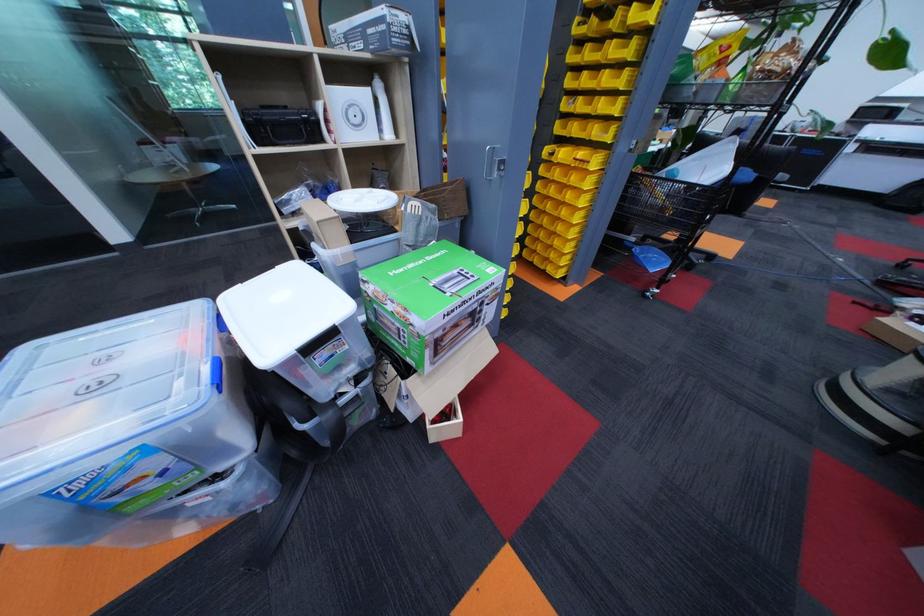
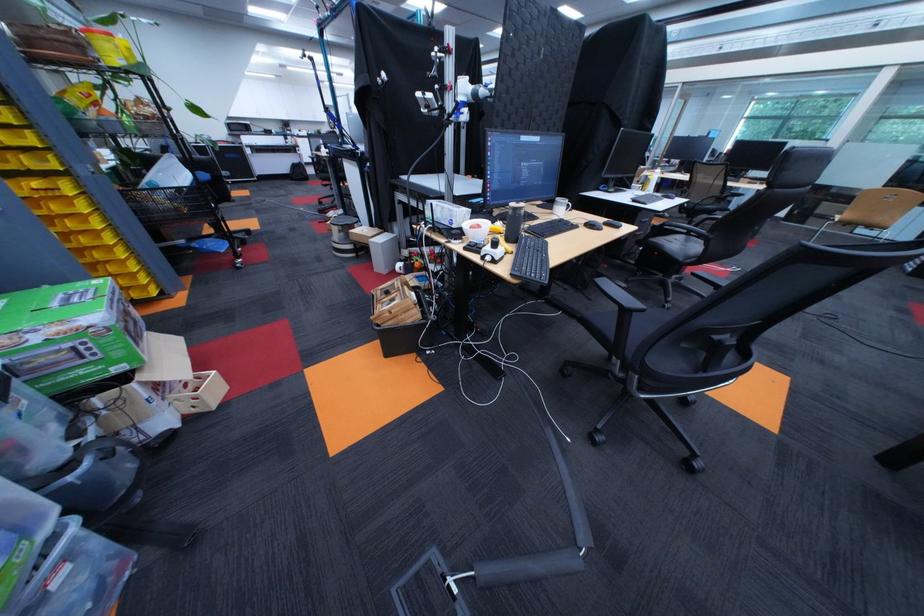
Locate, in the second image, the point that corresponds to point 609,132 in the first image.

(43, 163)